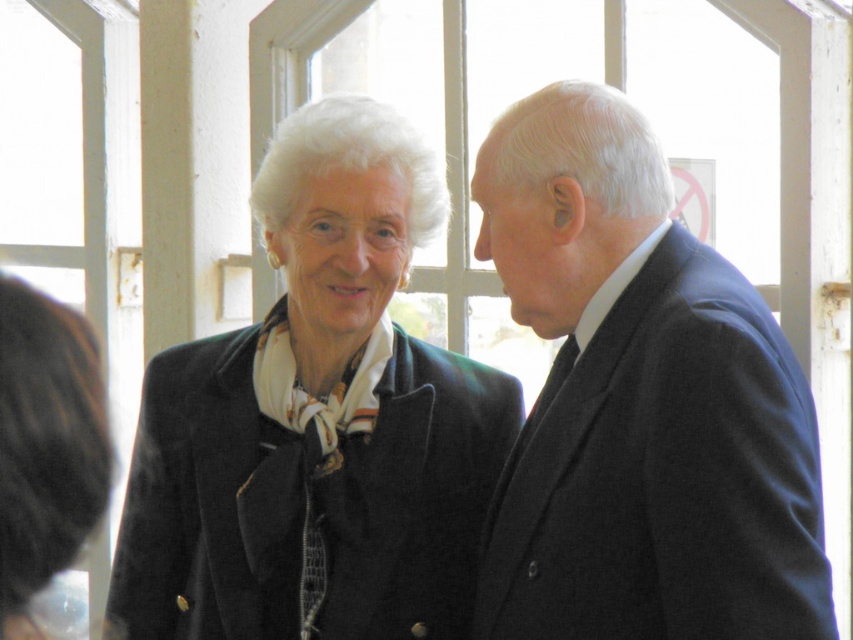
You are standing at the point marked as point (585, 637) and want to exit through the nearest door. The nearest door is 3 meters away from you. Can you reach the door without moving past the point?

The distance between you and the viewer is 2.82 meters, which is less than the 3 meters to the nearest door. Therefore, you can reach the door without moving past the point.

You are a photographer setting up a shoot in this room. You want to position a light source so that it illuminates both the dark blue suit at right and the matte black coat at center without causing harsh shadows. Based on their positions, where should you place the light source relative to the two objects?

The dark blue suit at right is below the matte black coat at center. To avoid harsh shadows, the light source should be placed above and between the two objects, casting light downward so that it reaches both the upper matte black coat at center and the lower dark blue suit at right evenly.